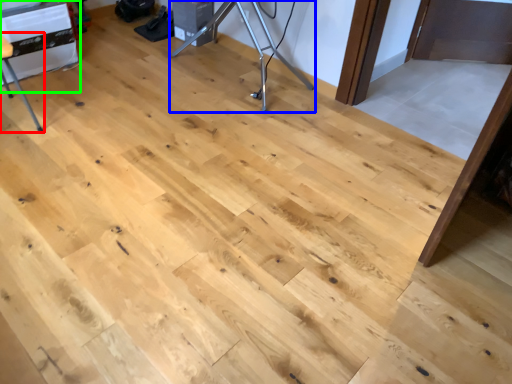
Question: Estimate the real-world distances between objects in this image. Which object is farther from furniture (highlighted by a red box), tripod (highlighted by a blue box) or table (highlighted by a green box)?

Choices:
 (A) tripod
 (B) table

Answer: (A)